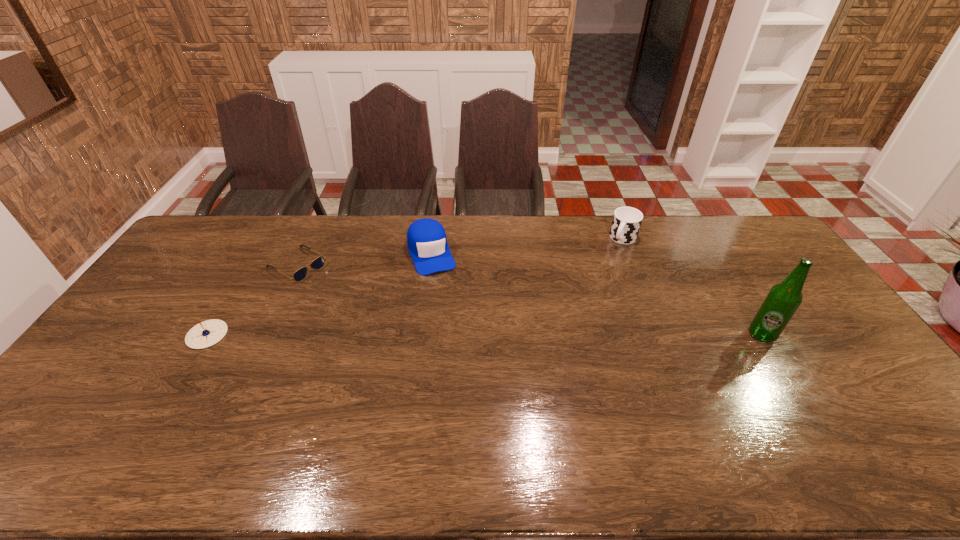
This screenshot has width=960, height=540. What are the coordinates of `compass` in the screenshot? It's located at (207, 333).

The width and height of the screenshot is (960, 540). I want to click on the leftmost object, so click(x=207, y=333).

Where is `beer bottle`? The height and width of the screenshot is (540, 960). beer bottle is located at coordinates (782, 301).

Where is `the rightmost object`? the rightmost object is located at coordinates (782, 301).

Identify the location of the third object from right to left. (426, 238).

Image resolution: width=960 pixels, height=540 pixels. Find the location of `the shortest object`. the shortest object is located at coordinates (318, 263).

The width and height of the screenshot is (960, 540). What are the coordinates of `the second object from left to right` in the screenshot? It's located at (318, 263).

Where is `cup`? This screenshot has height=540, width=960. cup is located at coordinates (626, 222).

I want to click on free region located on the back of the fourth tallest object, so (241, 278).

The width and height of the screenshot is (960, 540). Find the location of `vacant space located on the label of the rightmost object`. vacant space located on the label of the rightmost object is located at coordinates (784, 371).